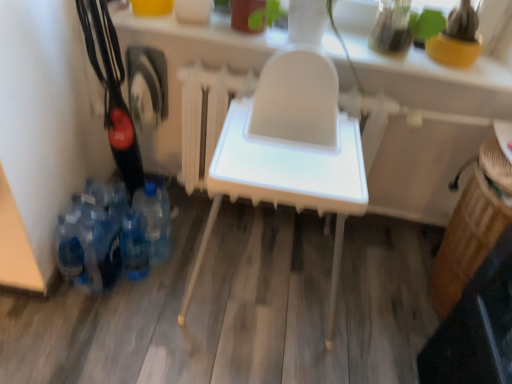
Where is `vacant area that lies between white plastic high chair at center and blue plastic bottle at lower left, arranged as the first bottle when viewed from the right`? vacant area that lies between white plastic high chair at center and blue plastic bottle at lower left, arranged as the first bottle when viewed from the right is located at coordinates (175, 274).